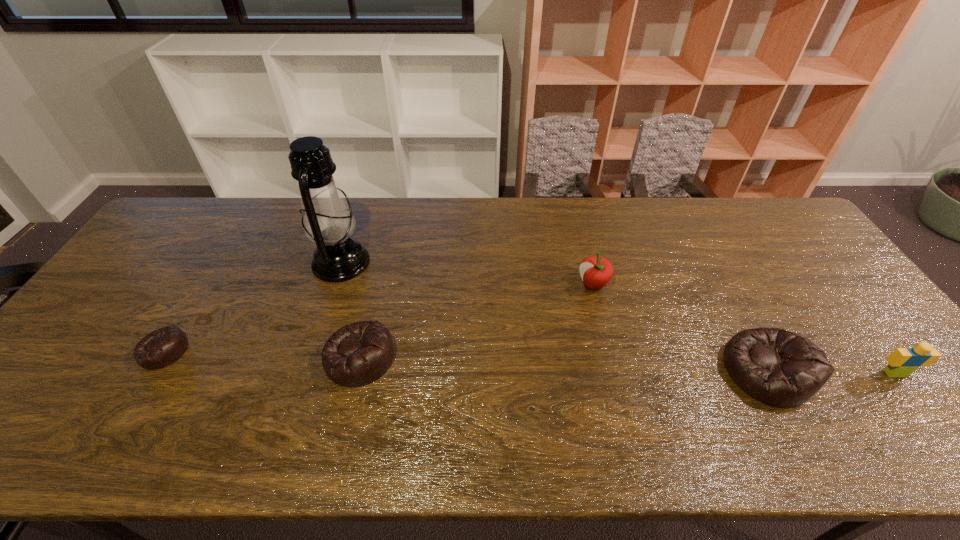
The height and width of the screenshot is (540, 960). What are the coordinates of `beanbag identified as the closest to the second object from right to left` in the screenshot? It's located at (357, 354).

Locate which beanbag is the closest to the shortest beanbag. Please provide its 2D coordinates. Your answer should be formatted as a tuple, i.e. [(x, y)], where the tuple contains the x and y coordinates of a point satisfying the conditions above.

[(357, 354)]

Locate an element on the screen. The image size is (960, 540). free location that satisfies the following two spatial constraints: 1. on the front side of the fourth object from left to right; 2. on the left side of the oil lamp is located at coordinates tap(334, 285).